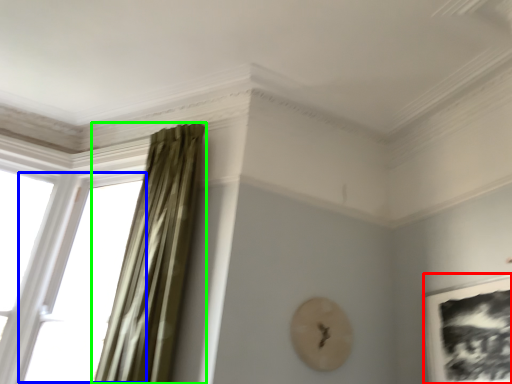
Question: Which object is positioned farthest from picture frame (highlighted by a red box)? Select from window (highlighted by a blue box) and curtain (highlighted by a green box).

Choices:
 (A) window
 (B) curtain

Answer: (A)